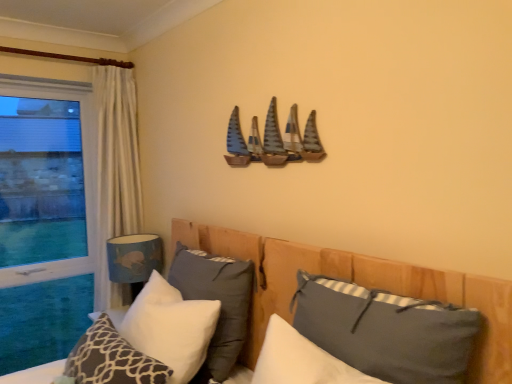
Question: Is point (52, 266) closer or farther from the camera than point (176, 374)?

Choices:
 (A) closer
 (B) farther

Answer: (B)

Question: Is transparent glass window at left wider or thinner than white soft pillow at lower left, positioned as the second pillow in left-to-right order?

Choices:
 (A) thin
 (B) wide

Answer: (A)

Question: Which of these objects is positioned closest to the blue fabric lampshade at lower left?

Choices:
 (A) dark gray fabric pillow at center, the fourth pillow viewed from the left
 (B) transparent glass window at left
 (C) wooden bed at center
 (D) white soft pillow at center, which is the 3th pillow in left-to-right order
 (E) wooden sailboats at upper center

Answer: (C)

Question: Which object is the farthest from the dark gray fabric pillow at lower right, the 1th pillow positioned from the right?

Choices:
 (A) transparent glass window at left
 (B) wooden bed at center
 (C) wooden sailboats at upper center
 (D) white textured pillow at lower left, arranged as the 1th pillow when viewed from the left
 (E) white soft pillow at center, which is counted as the third pillow, starting from the right

Answer: (A)